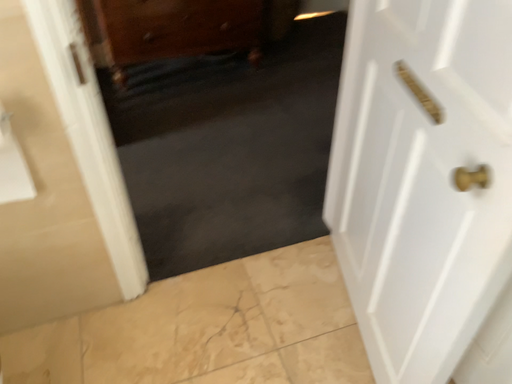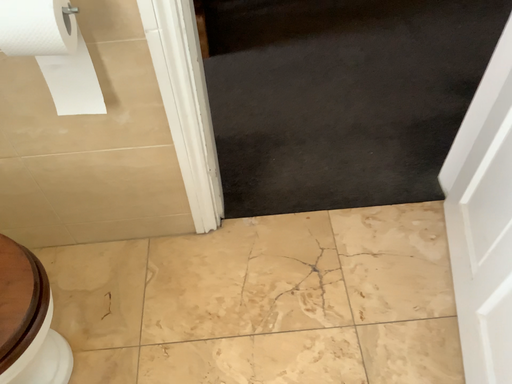
Question: How did the camera likely rotate when shooting the video?

Choices:
 (A) rotated upward
 (B) rotated downward

Answer: (B)